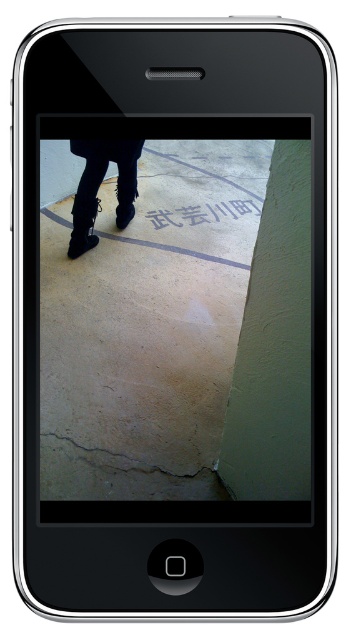
Is black leather boots at lower left shorter than brown rough concrete at lower center?

Incorrect, black leather boots at lower left's height does not fall short of brown rough concrete at lower center's.

Between point (82, 145) and point (57, 458), which one is positioned behind?

The point (82, 145) is behind.

Image resolution: width=351 pixels, height=640 pixels. What do you see at coordinates (98, 186) in the screenshot?
I see `black leather boots at lower left` at bounding box center [98, 186].

This screenshot has height=640, width=351. What are the coordinates of `black leather boots at lower left` in the screenshot? It's located at (98, 186).